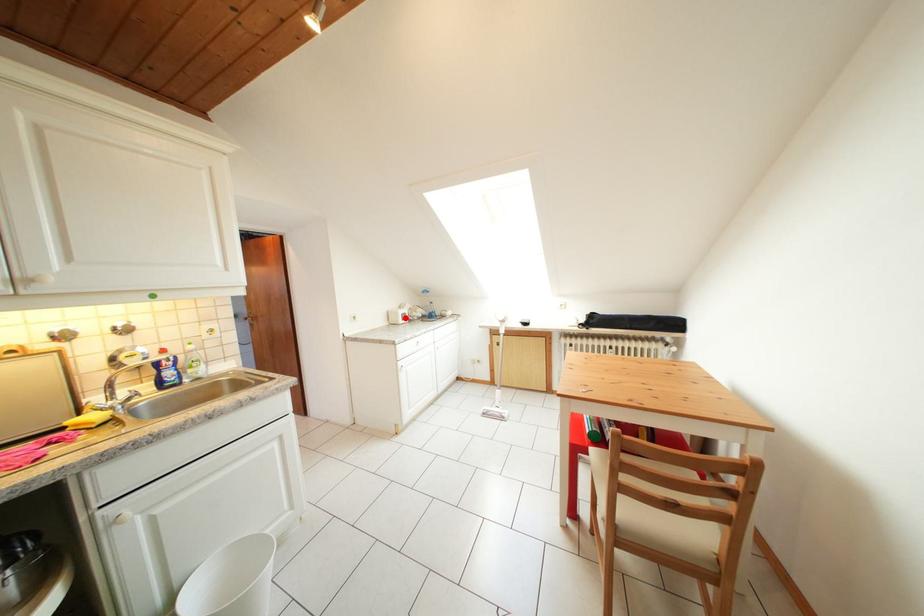
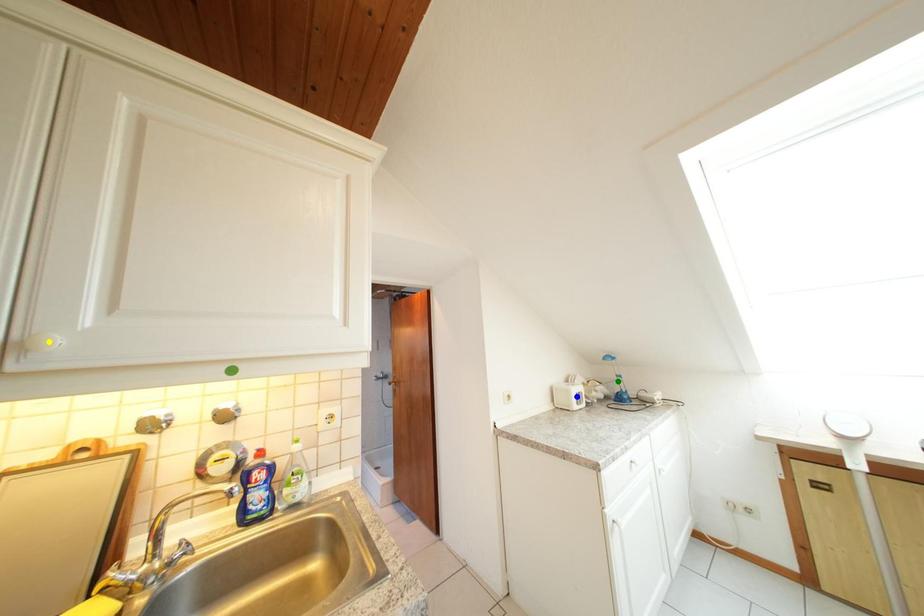
Question: I am providing you with two images of the same scene from different viewpoints. A red point is marked on the first image. You are given multiple points on the second image. Which point in image 2 is actually the same real-world point as the red point in image 1?

Choices:
 (A) green point
 (B) yellow point
 (C) blue point

Answer: (C)